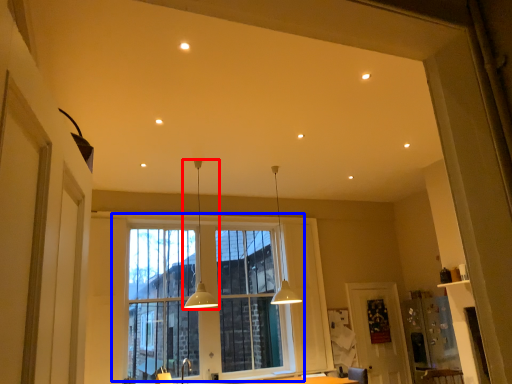
Question: Which of the following is the farthest to the observer, lamp (highlighted by a red box) or window (highlighted by a blue box)?

Choices:
 (A) lamp
 (B) window

Answer: (B)